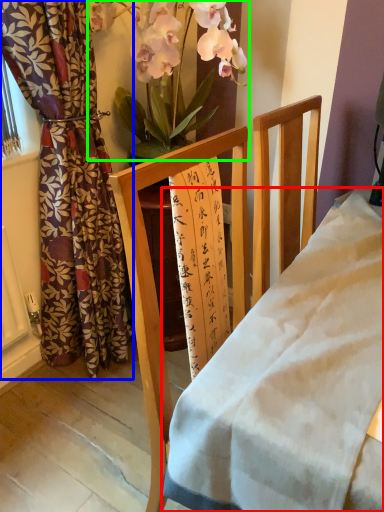
Question: Which object is the closest to the desk (highlighted by a red box)? Choose among these: curtain (highlighted by a blue box) or floral arrangement (highlighted by a green box).

Choices:
 (A) curtain
 (B) floral arrangement

Answer: (A)